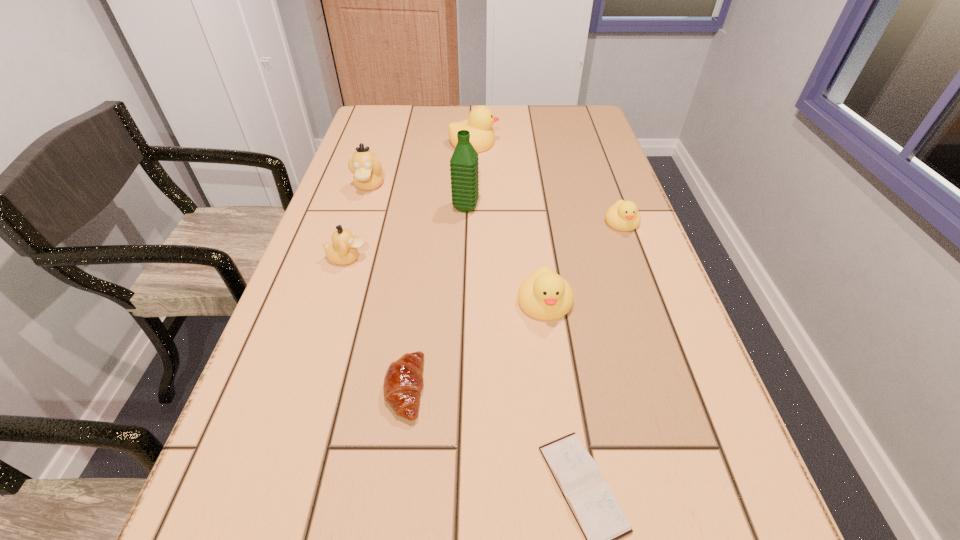
Find the location of `free space located on the right of the crescent roll`. free space located on the right of the crescent roll is located at coordinates (543, 389).

What are the coordinates of `object at the far edge` in the screenshot? It's located at (481, 118).

Identify the location of object present at the right edge. The image size is (960, 540). (623, 215).

In the image, there is a desktop. Find the location of `vacant space at the far edge`. vacant space at the far edge is located at coordinates (431, 116).

In the image, there is a desktop. What are the coordinates of `vacant space at the left edge` in the screenshot? It's located at (257, 386).

The width and height of the screenshot is (960, 540). I want to click on free region at the right edge of the desktop, so click(x=615, y=303).

In order to click on vacant space at the far left corner of the desktop in this screenshot , I will do `click(408, 136)`.

What are the coordinates of `vacant point located between the leftmost yellow duckling and the second shortest object` in the screenshot? It's located at (439, 266).

Where is `free space between the second farthest duckling and the rightmost duckling`? This screenshot has width=960, height=540. free space between the second farthest duckling and the rightmost duckling is located at coordinates (495, 204).

Locate an element on the screen. This screenshot has width=960, height=540. vacant area between the smaller tan duckling and the third nearest object is located at coordinates coord(446,280).